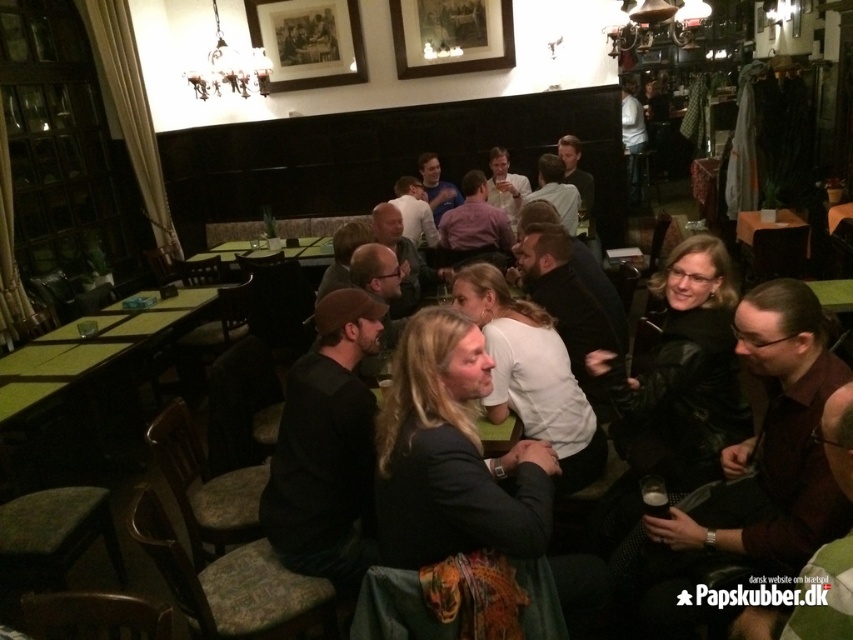
Question: Does dark brown leather jacket at center appear on the right side of green wooden table at center?

Choices:
 (A) yes
 (B) no

Answer: (A)

Question: Is dark brown leather jacket at center further to the viewer compared to green wooden table at center?

Choices:
 (A) no
 (B) yes

Answer: (A)

Question: Which point is closer to the camera?

Choices:
 (A) green wooden table at center
 (B) dark brown leather jacket at center

Answer: (B)

Question: Which point is closer to the camera?

Choices:
 (A) (224, 260)
 (B) (457, 627)

Answer: (B)

Question: Which point is farther from the camera taking this photo?

Choices:
 (A) (265, 250)
 (B) (415, 477)

Answer: (A)

Question: Is dark brown leather jacket at center to the left of green wooden table at center from the viewer's perspective?

Choices:
 (A) no
 (B) yes

Answer: (A)